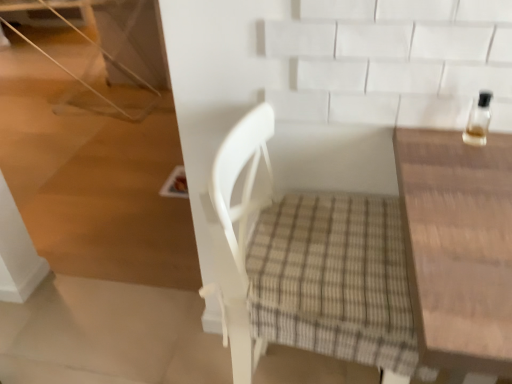
Question: Should I look upward or downward to see white woven chair at center?

Choices:
 (A) up
 (B) down

Answer: (B)

Question: Is wooden table at right completely or partially outside of clear glass bottle at upper right?

Choices:
 (A) no
 (B) yes

Answer: (B)

Question: Is wooden table at right far from clear glass bottle at upper right?

Choices:
 (A) yes
 (B) no

Answer: (B)

Question: From the image's perspective, would you say wooden table at right is shown under clear glass bottle at upper right?

Choices:
 (A) no
 (B) yes

Answer: (B)

Question: Can you confirm if wooden table at right is thinner than clear glass bottle at upper right?

Choices:
 (A) yes
 (B) no

Answer: (B)

Question: Is wooden table at right further to the viewer compared to clear glass bottle at upper right?

Choices:
 (A) yes
 (B) no

Answer: (B)

Question: Can you confirm if wooden table at right is positioned to the right of clear glass bottle at upper right?

Choices:
 (A) yes
 (B) no

Answer: (A)

Question: Can you confirm if white woven chair at center is shorter than clear glass bottle at upper right?

Choices:
 (A) no
 (B) yes

Answer: (A)

Question: Considering the relative positions of white woven chair at center and clear glass bottle at upper right in the image provided, is white woven chair at center behind clear glass bottle at upper right?

Choices:
 (A) no
 (B) yes

Answer: (A)

Question: From the image's perspective, is white woven chair at center under clear glass bottle at upper right?

Choices:
 (A) yes
 (B) no

Answer: (A)

Question: From a real-world perspective, is white woven chair at center physically above clear glass bottle at upper right?

Choices:
 (A) yes
 (B) no

Answer: (B)

Question: Does white woven chair at center appear on the right side of clear glass bottle at upper right?

Choices:
 (A) yes
 (B) no

Answer: (B)

Question: From the image's perspective, is white woven chair at center above clear glass bottle at upper right?

Choices:
 (A) yes
 (B) no

Answer: (B)

Question: Can you confirm if clear glass bottle at upper right is smaller than wooden table at right?

Choices:
 (A) yes
 (B) no

Answer: (A)